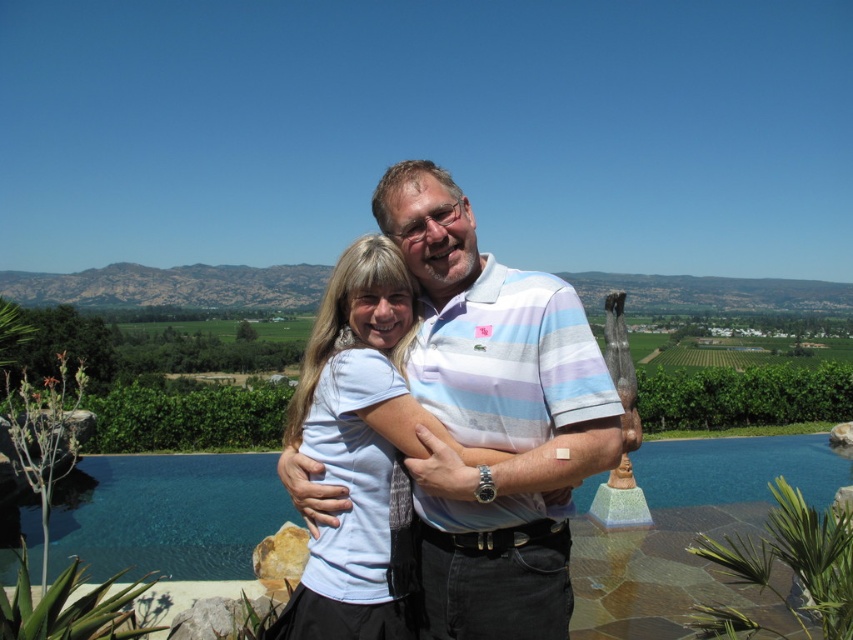
Question: Does white cotton shirt at center lie behind white matte shirt at center?

Choices:
 (A) yes
 (B) no

Answer: (A)

Question: Which object appears farthest from the camera in this image?

Choices:
 (A) white matte shirt at center
 (B) white cotton shirt at center

Answer: (B)

Question: Considering the relative positions of white cotton shirt at center and white matte shirt at center in the image provided, where is white cotton shirt at center located with respect to white matte shirt at center?

Choices:
 (A) below
 (B) above

Answer: (B)

Question: Does white cotton shirt at center come in front of white matte shirt at center?

Choices:
 (A) yes
 (B) no

Answer: (B)